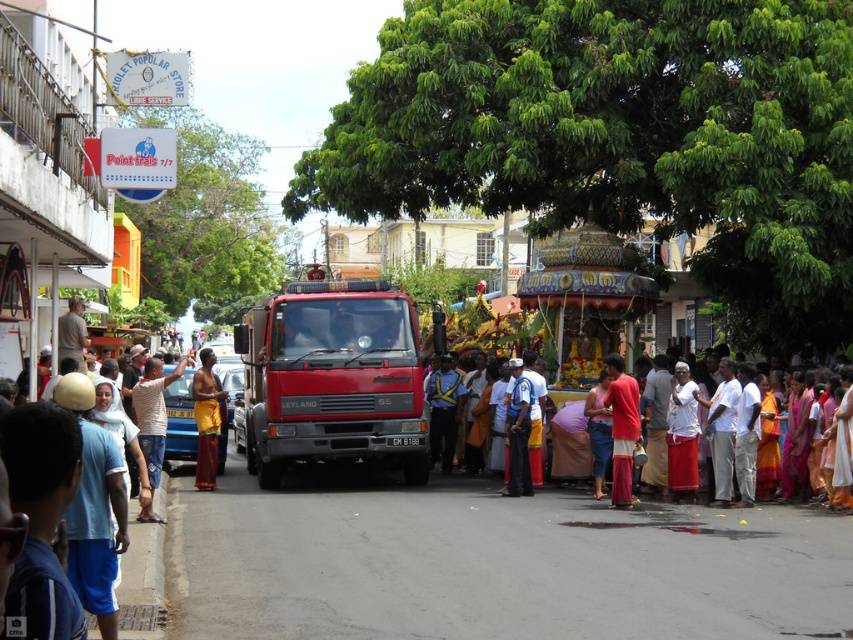
You are standing at the center of the street and see a point marked at coordinates (518, 432). What object is located at that point?

The light blue uniform at center is located at point (518, 432).

You are a photographer standing in the crowd at the event. You want to take a photo of the light blue uniform at center and the light brown shirt at center. Which one is positioned lower in the frame?

The light blue uniform at center is below the light brown shirt at center, so it is positioned lower in the frame.

You are standing in the middle of the street and want to take a photo. There are two points in the scene you want to capture clearly. The first point is point (529, 432) and the second is point (71, 326). Since you want both points in focus, which point should you focus on to ensure both are sharp?

You should focus on point (529, 432) because it is closer to the camera than point (71, 326). Focusing on the closer point will ensure the farther point is still within the depth of field.